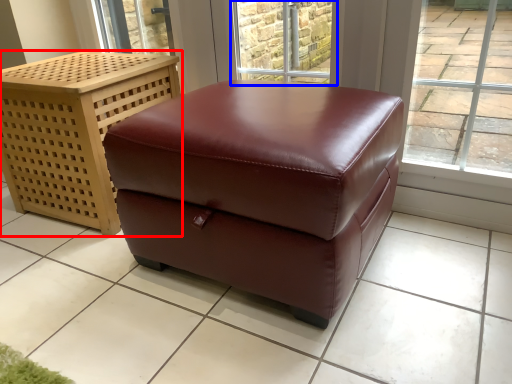
Question: Which object appears closest to the camera in this image, furniture (highlighted by a red box) or window (highlighted by a blue box)?

Choices:
 (A) furniture
 (B) window

Answer: (A)